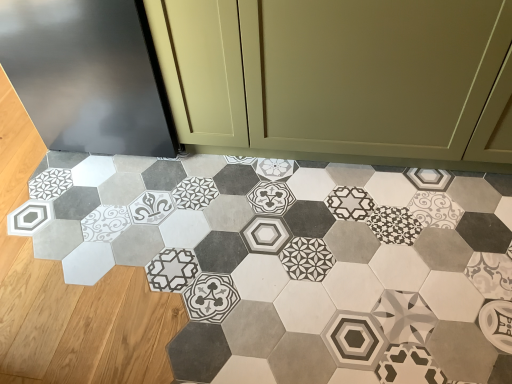
Question: Is matte olive green cabinet at center positioned far away from patterned hexagonal tile at center?

Choices:
 (A) no
 (B) yes

Answer: (A)

Question: From the image's perspective, is matte olive green cabinet at center above patterned hexagonal tile at center?

Choices:
 (A) no
 (B) yes

Answer: (B)

Question: From the image's perspective, is matte olive green cabinet at center under patterned hexagonal tile at center?

Choices:
 (A) yes
 (B) no

Answer: (B)

Question: Considering the relative positions of matte olive green cabinet at center and patterned hexagonal tile at center in the image provided, is matte olive green cabinet at center to the left of patterned hexagonal tile at center from the viewer's perspective?

Choices:
 (A) yes
 (B) no

Answer: (B)

Question: Considering the relative sizes of matte olive green cabinet at center and patterned hexagonal tile at center in the image provided, is matte olive green cabinet at center smaller than patterned hexagonal tile at center?

Choices:
 (A) no
 (B) yes

Answer: (A)

Question: From a real-world perspective, is matte olive green cabinet at center located beneath patterned hexagonal tile at center?

Choices:
 (A) no
 (B) yes

Answer: (A)

Question: From the image's perspective, would you say patterned hexagonal tile at center is positioned over matte olive green cabinet at center?

Choices:
 (A) yes
 (B) no

Answer: (B)

Question: From a real-world perspective, is patterned hexagonal tile at center on top of matte olive green cabinet at center?

Choices:
 (A) yes
 (B) no

Answer: (B)

Question: Can you confirm if patterned hexagonal tile at center is positioned to the right of matte olive green cabinet at center?

Choices:
 (A) yes
 (B) no

Answer: (B)

Question: Could you tell me if patterned hexagonal tile at center is turned towards matte olive green cabinet at center?

Choices:
 (A) yes
 (B) no

Answer: (B)

Question: Is patterned hexagonal tile at center with matte olive green cabinet at center?

Choices:
 (A) no
 (B) yes

Answer: (A)

Question: Is patterned hexagonal tile at center wider than matte olive green cabinet at center?

Choices:
 (A) no
 (B) yes

Answer: (B)

Question: Looking at the image, does matte olive green cabinet at center seem bigger or smaller compared to patterned hexagonal tile at center?

Choices:
 (A) big
 (B) small

Answer: (A)